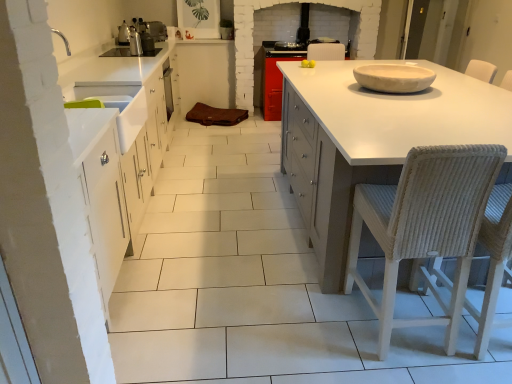
Question: Does white ceramic bowl at upper right have a lesser width compared to metallic stainless steel kettle at upper left?

Choices:
 (A) yes
 (B) no

Answer: (B)

Question: Can you confirm if white ceramic bowl at upper right is positioned to the right of metallic stainless steel kettle at upper left?

Choices:
 (A) no
 (B) yes

Answer: (B)

Question: Could metallic stainless steel kettle at upper left be considered to be inside white ceramic bowl at upper right?

Choices:
 (A) yes
 (B) no

Answer: (B)

Question: From a real-world perspective, is white ceramic bowl at upper right below metallic stainless steel kettle at upper left?

Choices:
 (A) no
 (B) yes

Answer: (B)

Question: From a real-world perspective, is white ceramic bowl at upper right positioned over metallic stainless steel kettle at upper left based on gravity?

Choices:
 (A) yes
 (B) no

Answer: (B)

Question: Considering the relative positions of white ceramic bowl at upper right and metallic stainless steel kettle at upper left in the image provided, is white ceramic bowl at upper right to the left of metallic stainless steel kettle at upper left from the viewer's perspective?

Choices:
 (A) no
 (B) yes

Answer: (A)

Question: Is metallic stainless steel kettle at upper left completely or partially outside of woven straw chair at right, the 2th chair when ordered from left to right?

Choices:
 (A) no
 (B) yes

Answer: (B)

Question: Is the position of metallic stainless steel kettle at upper left less distant than that of woven straw chair at right, the 2th chair when ordered from left to right?

Choices:
 (A) yes
 (B) no

Answer: (B)

Question: Is metallic stainless steel kettle at upper left at the right side of woven straw chair at right, the 2th chair when ordered from left to right?

Choices:
 (A) yes
 (B) no

Answer: (B)

Question: Considering the relative sizes of metallic stainless steel kettle at upper left and woven straw chair at right, arranged as the first chair when viewed from the right, in the image provided, is metallic stainless steel kettle at upper left taller than woven straw chair at right, arranged as the first chair when viewed from the right,?

Choices:
 (A) no
 (B) yes

Answer: (A)

Question: Can you confirm if metallic stainless steel kettle at upper left is smaller than woven straw chair at right, arranged as the first chair when viewed from the right?

Choices:
 (A) yes
 (B) no

Answer: (A)

Question: From the image's perspective, is metallic stainless steel kettle at upper left located beneath woven straw chair at right, arranged as the first chair when viewed from the right?

Choices:
 (A) yes
 (B) no

Answer: (B)

Question: Is white matte countertop at center far from woven wicker chair at right, arranged as the first chair when viewed from the left?

Choices:
 (A) no
 (B) yes

Answer: (A)